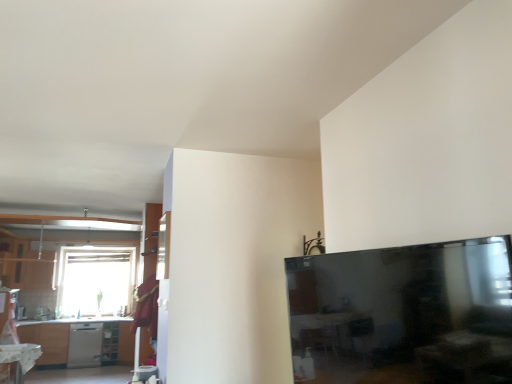
Where is `matte white shelf at lower left`? Image resolution: width=512 pixels, height=384 pixels. matte white shelf at lower left is located at coordinates (110, 343).

Measure the distance between point (102,343) and camera.

The distance of point (102,343) from camera is 19.53 feet.

Locate an element on the screen. transparent glass window at upper left is located at coordinates (95, 280).

The height and width of the screenshot is (384, 512). Describe the element at coordinates (85, 345) in the screenshot. I see `satin silver dishwasher at lower left` at that location.

From the picture: What is the approximate height of satin silver dishwasher at lower left?

satin silver dishwasher at lower left is 34.08 inches tall.

This screenshot has height=384, width=512. What are the coordinates of `white glossy table at lower left` in the screenshot? It's located at (17, 361).

At what (x,y) coordinates should I click in order to perform the action: click on matte white shelf at lower left. Please return your answer as a coordinate pair (x, y). Looking at the image, I should click on (110, 343).

Would you say transparent glass window at upper left is outside satin silver dishwasher at lower left?

transparent glass window at upper left lies outside satin silver dishwasher at lower left's area.

I want to click on dish washer that appears on the right of transparent glass window at upper left, so click(85, 345).

From their relative heights in the image, would you say transparent glass window at upper left is taller or shorter than satin silver dishwasher at lower left?

Considering their sizes, transparent glass window at upper left has more height than satin silver dishwasher at lower left.

Consider the image. Which object is closer to the camera, matte white shelf at lower left or satin silver dishwasher at lower left?

Positioned in front is satin silver dishwasher at lower left.

From a real-world perspective, between matte white shelf at lower left and satin silver dishwasher at lower left, who is vertically higher?

In real-world perspective, satin silver dishwasher at lower left is above.

Can you confirm if matte white shelf at lower left is bigger than satin silver dishwasher at lower left?

No, matte white shelf at lower left is not bigger than satin silver dishwasher at lower left.

How many degrees apart are the facing directions of matte white shelf at lower left and satin silver dishwasher at lower left?

0.589 degrees.

Based on the photo, in terms of width, does matte wood cabinet at left look wider or thinner when compared to matte white shelf at lower left?

Considering their sizes, matte wood cabinet at left looks slimmer than matte white shelf at lower left.

Can you confirm if matte wood cabinet at left is bigger than matte white shelf at lower left?

Indeed, matte wood cabinet at left has a larger size compared to matte white shelf at lower left.

From the image's perspective, between matte wood cabinet at left and matte white shelf at lower left, who is located below?

matte white shelf at lower left appears lower in the image.

Is transparent glass window at upper left shorter than matte white shelf at lower left?

Incorrect, the height of transparent glass window at upper left does not fall short of that of matte white shelf at lower left.

At what (x,y) coordinates should I click in order to perform the action: click on shelf located below the transparent glass window at upper left (from the image's perspective). Please return your answer as a coordinate pair (x, y). This screenshot has height=384, width=512. Looking at the image, I should click on (110, 343).

How many degrees apart are the facing directions of transparent glass window at upper left and matte white shelf at lower left?

There is a 0.745-degree angle between the facing directions of transparent glass window at upper left and matte white shelf at lower left.

Does transparent glass window at upper left contain matte white shelf at lower left?

No, transparent glass window at upper left does not contain matte white shelf at lower left.

Relative to satin silver dishwasher at lower left, is matte wood cabinet at left in front or behind?

Visually, matte wood cabinet at left is located in front of satin silver dishwasher at lower left.

Looking at this image, from the image's perspective, is matte wood cabinet at left above or below satin silver dishwasher at lower left?

Clearly, from the image's perspective, matte wood cabinet at left is above satin silver dishwasher at lower left.

Is matte wood cabinet at left oriented away from transparent glass window at upper left?

No, matte wood cabinet at left is not facing the opposite direction of transparent glass window at upper left.

Which is behind, point (38, 273) or point (96, 256)?

Positioned behind is point (96, 256).

From a real-world perspective, between matte wood cabinet at left and transparent glass window at upper left, who is vertically lower?

In real-world perspective, transparent glass window at upper left is lower.

Which point is more forward, (x=36, y=358) or (x=114, y=274)?

Point (x=36, y=358)

Is white glossy table at lower left directly adjacent to transparent glass window at upper left?

No, white glossy table at lower left is not next to transparent glass window at upper left.

Does white glossy table at lower left have a smaller size compared to transparent glass window at upper left?

Indeed, white glossy table at lower left has a smaller size compared to transparent glass window at upper left.

From the image's perspective, which one is positioned lower, white glossy table at lower left or transparent glass window at upper left?

white glossy table at lower left, from the image's perspective.

In the image, there is a transparent glass window at upper left. Where is `dish washer below it (from the image's perspective)`? The image size is (512, 384). dish washer below it (from the image's perspective) is located at coordinates (85, 345).

This screenshot has height=384, width=512. What are the coordinates of `shelf below the satin silver dishwasher at lower left (from a real-world perspective)` in the screenshot? It's located at (110, 343).

Estimate the real-world distances between objects in this image. Which object is further from matte white shelf at lower left, white glossy table at lower left or satin silver dishwasher at lower left?

Among the two, white glossy table at lower left is located further to matte white shelf at lower left.

Estimate the real-world distances between objects in this image. Which object is further from white glossy table at lower left, satin silver dishwasher at lower left or transparent glass window at upper left?

Among the two, transparent glass window at upper left is located further to white glossy table at lower left.

Looking at the image, which one is located closer to matte white shelf at lower left, satin silver dishwasher at lower left or matte wood cabinet at left?

satin silver dishwasher at lower left is closer to matte white shelf at lower left.

Estimate the real-world distances between objects in this image. Which object is closer to transparent glass window at upper left, white glossy table at lower left or matte wood cabinet at left?

matte wood cabinet at left is positioned closer to the anchor transparent glass window at upper left.

Which object lies nearer to the anchor point satin silver dishwasher at lower left, transparent glass window at upper left or white glossy table at lower left?

transparent glass window at upper left is closer to satin silver dishwasher at lower left.

Considering their positions, is satin silver dishwasher at lower left positioned further to white glossy table at lower left than matte wood cabinet at left?

matte wood cabinet at left is further to white glossy table at lower left.

Consider the image. Looking at the image, which one is located closer to transparent glass window at upper left, matte wood cabinet at left or matte white shelf at lower left?

The object closer to transparent glass window at upper left is matte wood cabinet at left.

Based on their spatial positions, is satin silver dishwasher at lower left or matte white shelf at lower left further from white glossy table at lower left?

matte white shelf at lower left is further to white glossy table at lower left.

I want to click on cabinetry between white glossy table at lower left and satin silver dishwasher at lower left along the z-axis, so click(x=23, y=263).

The image size is (512, 384). Find the location of `cabinetry between white glossy table at lower left and transparent glass window at upper left from front to back`. cabinetry between white glossy table at lower left and transparent glass window at upper left from front to back is located at coordinates (23, 263).

Find the location of a particular element. The height and width of the screenshot is (384, 512). shelf between white glossy table at lower left and transparent glass window at upper left from front to back is located at coordinates (110, 343).

Identify the location of window between matte wood cabinet at left and matte white shelf at lower left from left to right. The height and width of the screenshot is (384, 512). (95, 280).